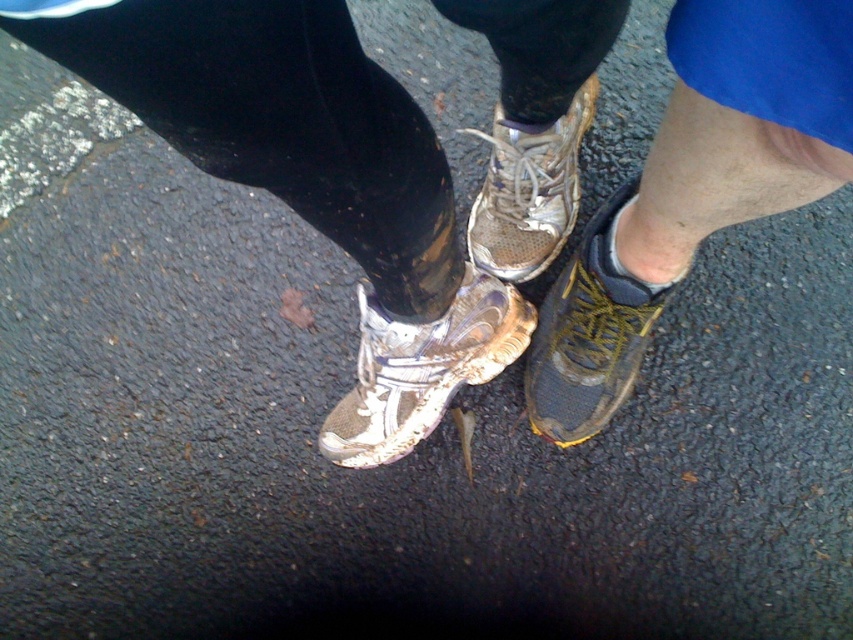
Can you confirm if shiny black shoe at lower right is smaller than worn leather shoe at center?

Yes, shiny black shoe at lower right is smaller than worn leather shoe at center.

Which of these two, shiny black shoe at lower right or worn leather shoe at center, stands taller?

Standing taller between the two is shiny black shoe at lower right.

Is point (589, 232) positioned in front of point (469, 248)?

Yes, it is.

Locate an element on the screen. The image size is (853, 640). shiny black shoe at lower right is located at coordinates (589, 333).

Measure the distance between shiny white running shoe at center and worn leather shoe at center.

7.60 inches

Looking at this image, who is taller, shiny white running shoe at center or worn leather shoe at center?

worn leather shoe at center

Is point (387, 371) farther from viewer compared to point (544, 188)?

No, it is in front of (544, 188).

This screenshot has height=640, width=853. Identify the location of shiny white running shoe at center. (422, 369).

Can you confirm if shiny white running shoe at center is positioned above shiny black shoe at lower right?

No, shiny white running shoe at center is not above shiny black shoe at lower right.

Is point (474, 305) positioned in front of point (602, 358)?

No, (474, 305) is further to viewer.

Image resolution: width=853 pixels, height=640 pixels. I want to click on shiny white running shoe at center, so click(422, 369).